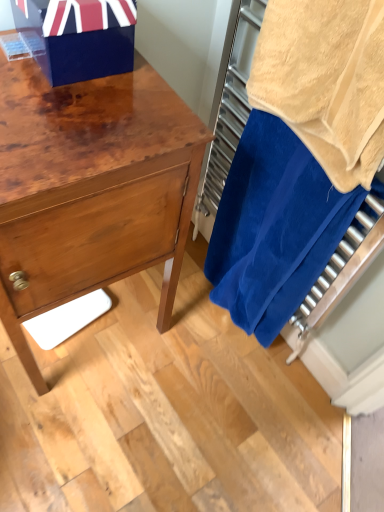
Question: Considering the relative sizes of shiny blue gift box at upper left and beige terry cloth towel at right in the image provided, is shiny blue gift box at upper left smaller than beige terry cloth towel at right?

Choices:
 (A) no
 (B) yes

Answer: (B)

Question: Considering the relative positions of shiny blue gift box at upper left and beige terry cloth towel at right in the image provided, is shiny blue gift box at upper left behind beige terry cloth towel at right?

Choices:
 (A) no
 (B) yes

Answer: (B)

Question: Would you say shiny blue gift box at upper left is a long distance from beige terry cloth towel at right?

Choices:
 (A) no
 (B) yes

Answer: (A)

Question: Is beige terry cloth towel at right at the back of shiny blue gift box at upper left?

Choices:
 (A) yes
 (B) no

Answer: (B)

Question: Considering the relative sizes of shiny blue gift box at upper left and beige terry cloth towel at right in the image provided, is shiny blue gift box at upper left taller than beige terry cloth towel at right?

Choices:
 (A) yes
 (B) no

Answer: (B)

Question: Does shiny blue gift box at upper left have a lesser height compared to beige terry cloth towel at right?

Choices:
 (A) no
 (B) yes

Answer: (B)

Question: Is shiny wood chest of drawers at left surrounded by shiny blue gift box at upper left?

Choices:
 (A) yes
 (B) no

Answer: (B)

Question: From a real-world perspective, is shiny blue gift box at upper left under shiny wood chest of drawers at left?

Choices:
 (A) yes
 (B) no

Answer: (B)

Question: Does shiny blue gift box at upper left come behind shiny wood chest of drawers at left?

Choices:
 (A) yes
 (B) no

Answer: (A)

Question: Does shiny blue gift box at upper left have a larger size compared to shiny wood chest of drawers at left?

Choices:
 (A) yes
 (B) no

Answer: (B)

Question: Considering the relative sizes of shiny blue gift box at upper left and shiny wood chest of drawers at left in the image provided, is shiny blue gift box at upper left smaller than shiny wood chest of drawers at left?

Choices:
 (A) no
 (B) yes

Answer: (B)

Question: Does shiny blue gift box at upper left have a lesser height compared to shiny wood chest of drawers at left?

Choices:
 (A) no
 (B) yes

Answer: (B)

Question: Can you confirm if shiny wood chest of drawers at left is positioned to the right of blue terry cloth towel at right?

Choices:
 (A) no
 (B) yes

Answer: (A)